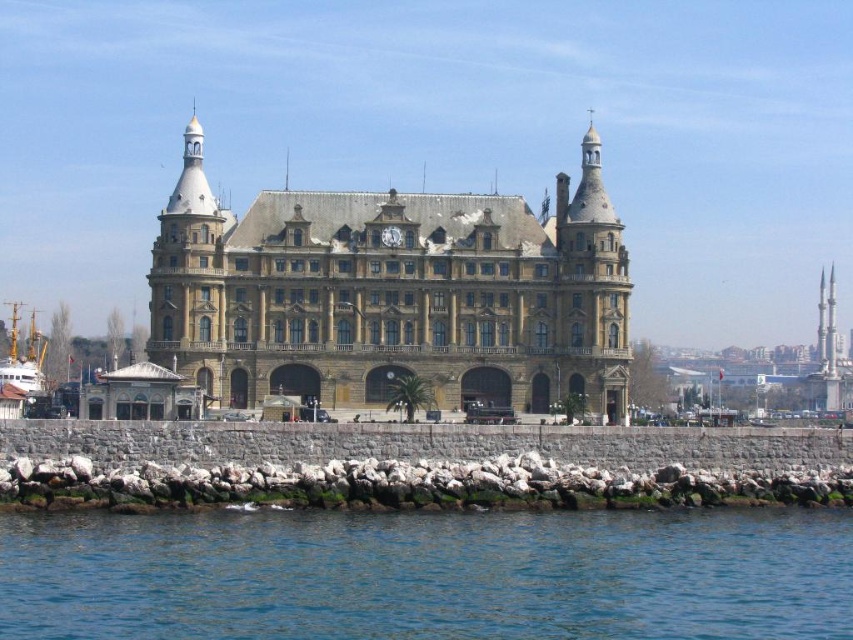
You are standing on the waterfront near the historic building and want to take a photo of both the blue liquid water at lower center and the wooden ship at lower left. Which object should you position closer to the front of your camera frame to include both in the shot?

You should position the blue liquid water at lower center closer to the front of your camera frame since it is closer to the viewer than the wooden ship at lower left, allowing both to be captured effectively in the photo.

You are standing at the waterfront facing the historic building. You notice two points marked on the building facade. The first point is at coordinates point (641, 566) and the second is at point (428, 269). If you want to reach the point that is closer to you, which one should you aim for?

You should aim for point (641, 566) because it is closer to the viewer than point (428, 269).

You are standing on the waterfront and want to take a photo of the brown stone building at center. If your camera has a maximum zoom range of 100 meters, will you be able to capture the entire building in the photo without moving closer?

The distance between you and the brown stone building at center is 126.03 meters, which exceeds the camera maximum zoom range of 100 meters. Therefore, you will not be able to capture the entire building in the photo without moving closer.